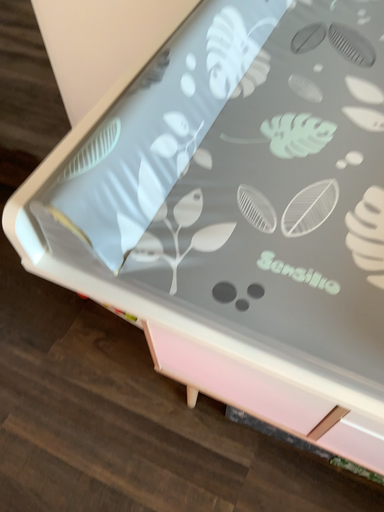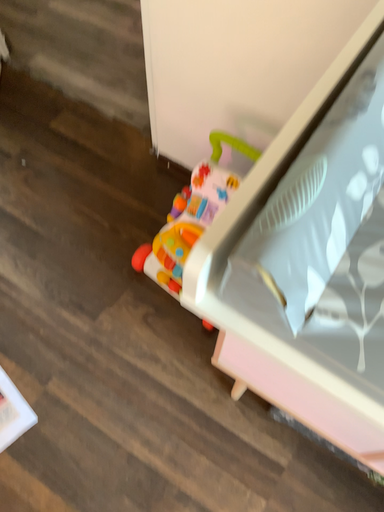
Question: How did the camera likely rotate when shooting the video?

Choices:
 (A) rotated upward
 (B) rotated downward

Answer: (B)